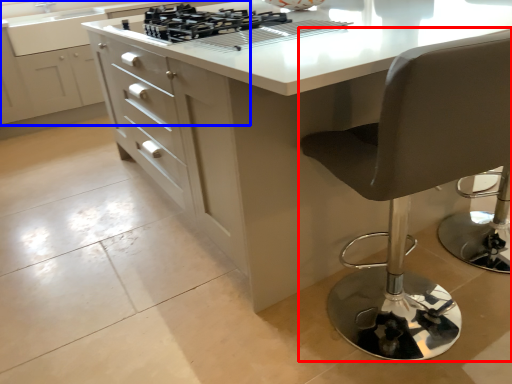
Question: Which object appears closest to the camera in this image, chair (highlighted by a red box) or cabinetry (highlighted by a blue box)?

Choices:
 (A) chair
 (B) cabinetry

Answer: (A)